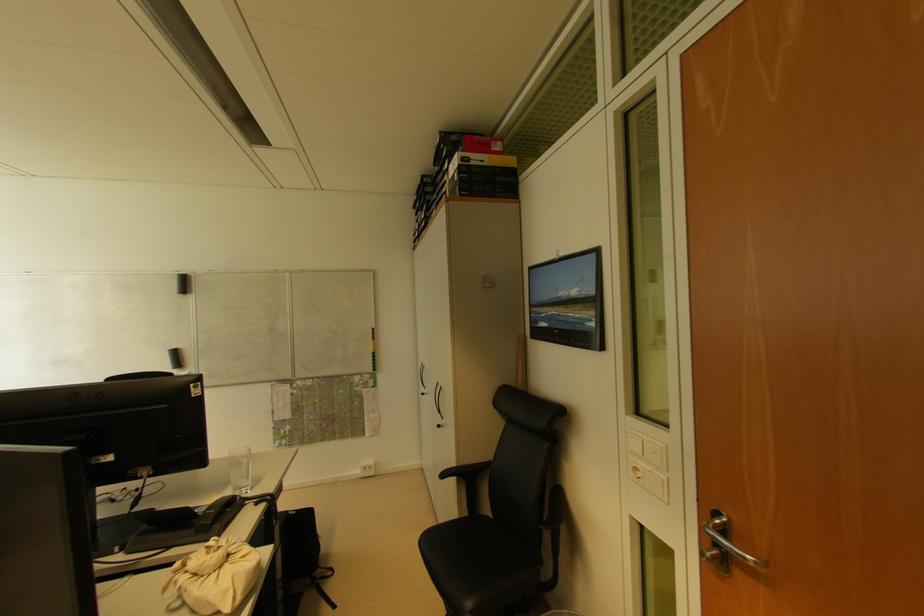
I want to click on telephone handset, so click(169, 533).